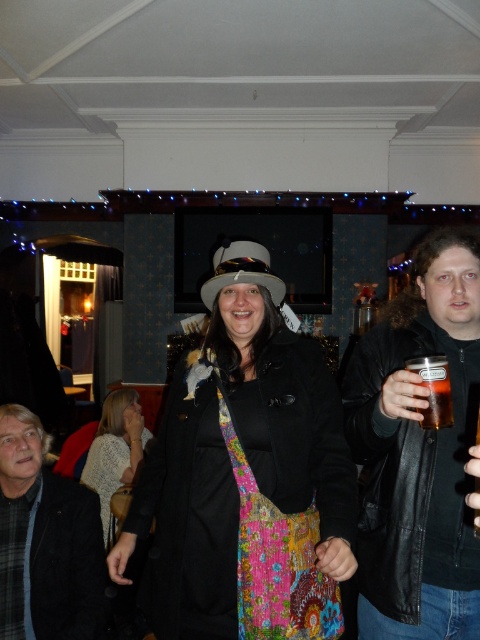
You are standing at the point with coordinates point (x=410, y=404) and want to move towards the point with coordinates point (x=156, y=440). Will you be moving forward or backward in the scene?

Since point (x=156, y=440) is behind point (x=410, y=404), moving towards it would require moving backward in the scene.

You are attending a party and notice two coats hanging on a coat rack in the room. The coats are the matte black coat at center and the dark gray woolen jacket at center. Which one is located to the right of the other?

The matte black coat at center is positioned on the right side of dark gray woolen jacket at center.